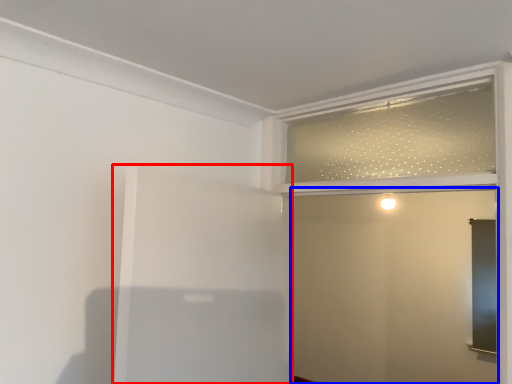
Question: Which of the following is the farthest to the observer, elevator (highlighted by a red box) or screen door (highlighted by a blue box)?

Choices:
 (A) elevator
 (B) screen door

Answer: (B)